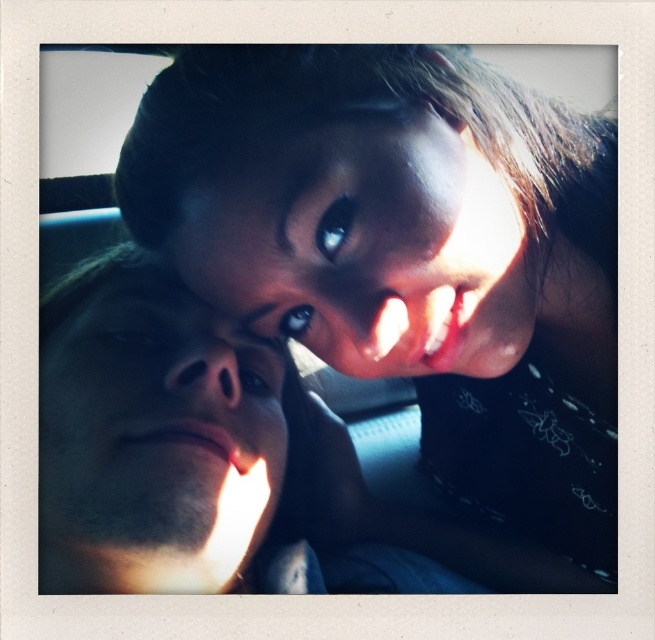
You are a photographer adjusting the lighting for a portrait session. You notice the matte black hair at upper center and the smooth skin face at upper center in your frame. Which object is positioned to the right side of the frame?

The matte black hair at upper center is to the right of the smooth skin face at upper center, so the matte black hair at upper center is positioned to the right side of the frame.

You are standing in front of the two people in the image. Based on their positions, which point, point (x=324, y=241) or point (x=364, y=326), is farther from you?

Point (x=324, y=241) is behind point (x=364, y=326), so it is farther from you.

You are an artist trying to draw the scene. You need to determine which of the two points, point (147, 282) or point (441, 196), is closer to the viewer. Which one should you depict as closer?

Point (147, 282) is further to the viewer than point (441, 196), so you should depict point (147, 282) as closer to the viewer.